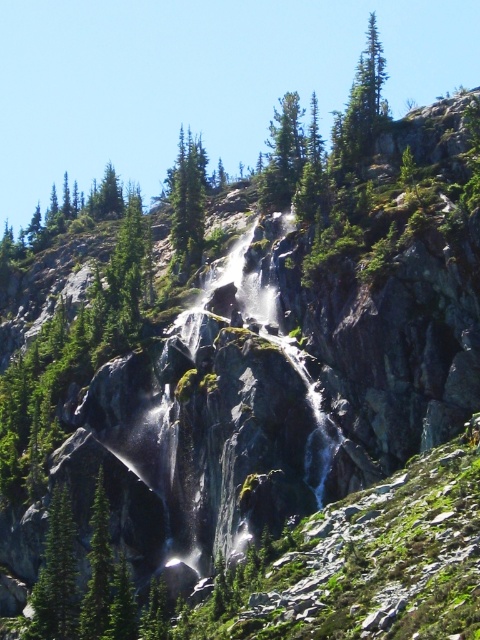
You are standing at point (57, 577) in the image. Looking around, you see a green matte tree at center left. What is the nearest object to you?

The nearest object to you is the green matte tree at center left located at point (57, 577).